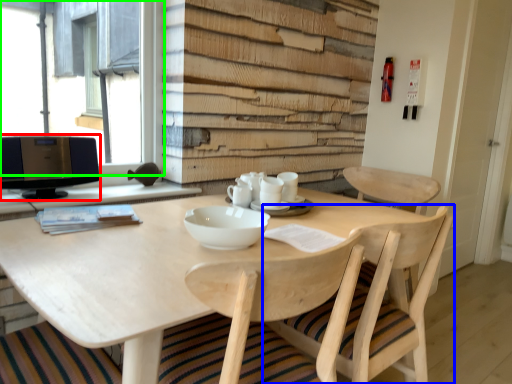
Question: Which is farther away from computer monitor (highlighted by a red box)? chair (highlighted by a blue box) or window (highlighted by a green box)?

Choices:
 (A) chair
 (B) window

Answer: (A)